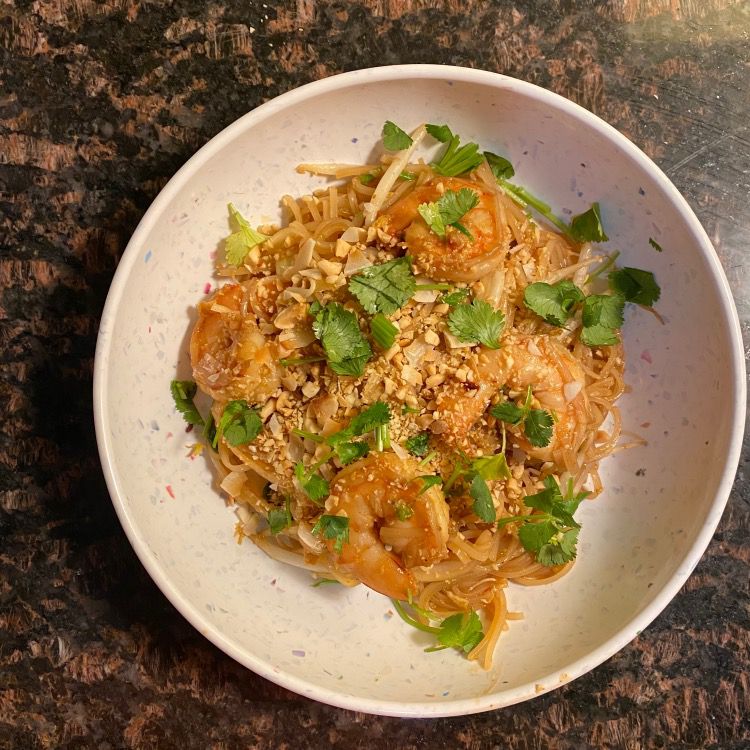
Where is `blue speckles on bowl`? blue speckles on bowl is located at coordinates (650, 244), (298, 652), (154, 424), (640, 472), (351, 139).